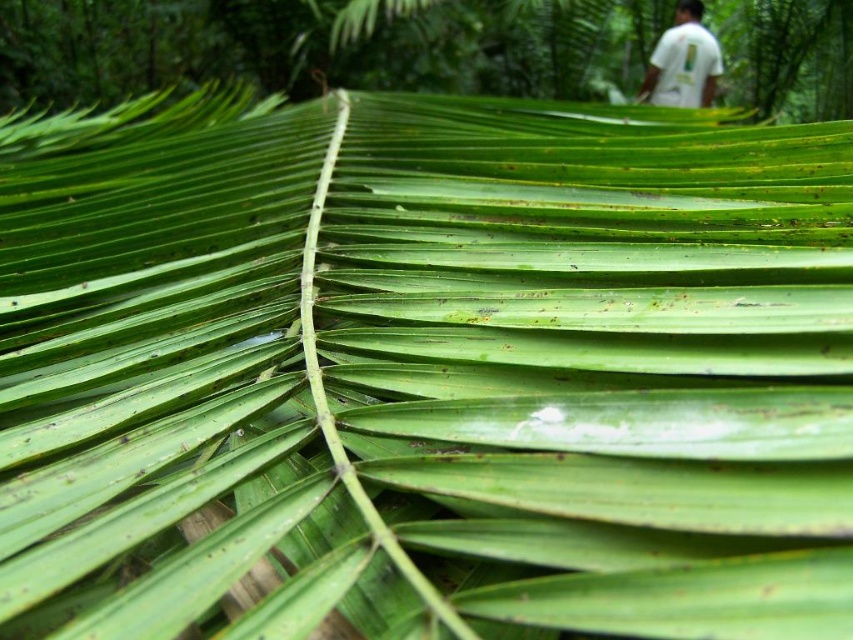
Question: Which of the following is the farthest from the observer?

Choices:
 (A) green leafy palm at upper center
 (B) white t-shirt at upper right

Answer: (B)

Question: Is green leafy palm at upper center behind white t-shirt at upper right?

Choices:
 (A) no
 (B) yes

Answer: (A)

Question: Is green leafy palm at upper center smaller than white t-shirt at upper right?

Choices:
 (A) no
 (B) yes

Answer: (A)

Question: Among these objects, which one is nearest to the camera?

Choices:
 (A) green leafy palm at upper center
 (B) white t-shirt at upper right

Answer: (A)

Question: Which point is closer to the camera?

Choices:
 (A) (653, 61)
 (B) (408, 36)

Answer: (B)

Question: From the image, what is the correct spatial relationship of green leafy palm at upper center in relation to white t-shirt at upper right?

Choices:
 (A) right
 (B) left

Answer: (B)